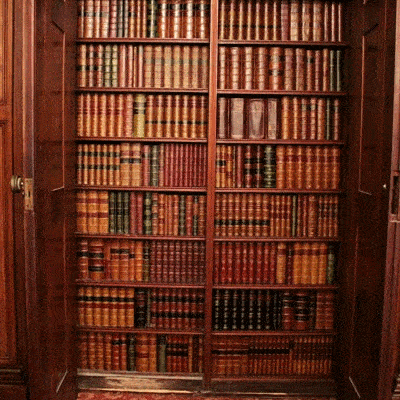
Find the location of a particular element. The height and width of the screenshot is (400, 400). bottom of wooden shelf is located at coordinates (162, 383), (240, 387).